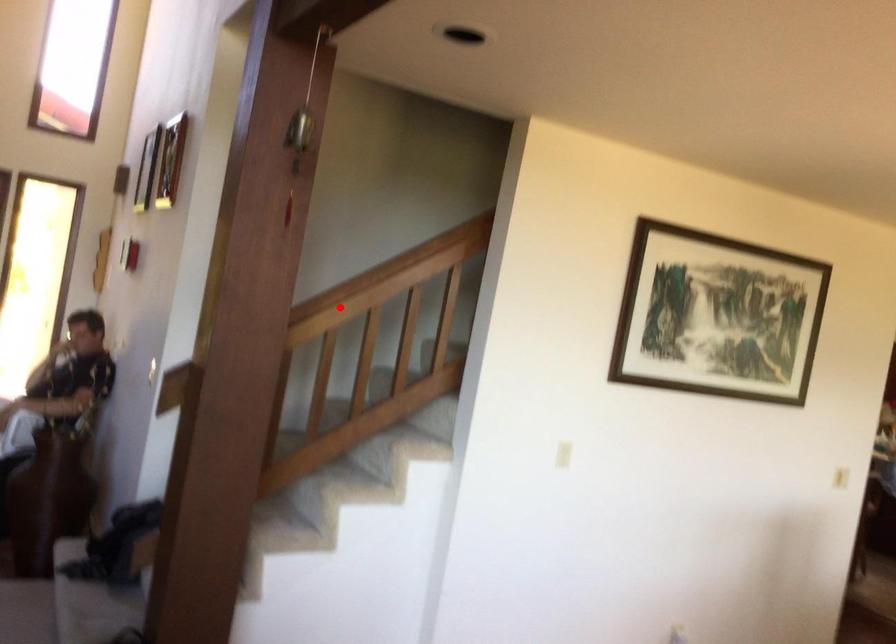
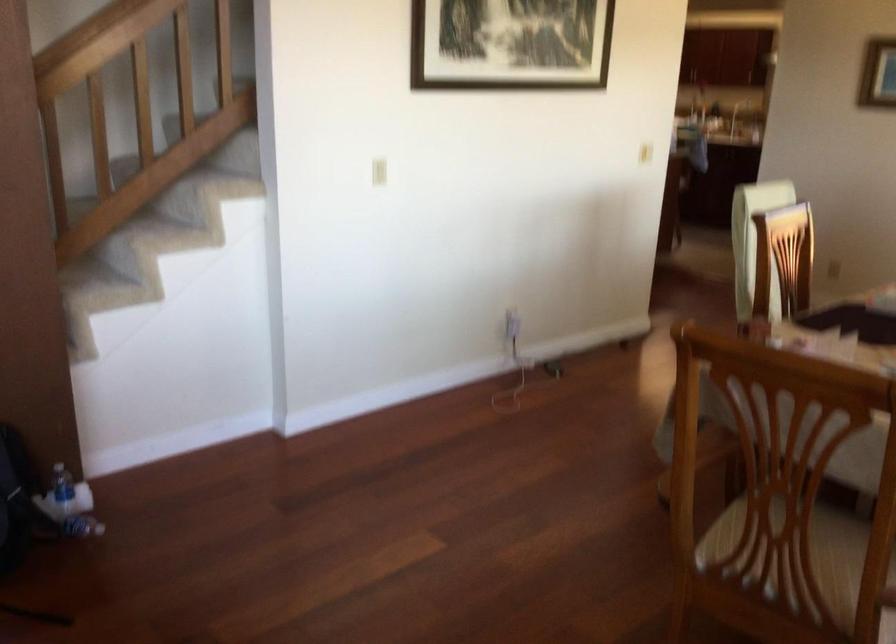
Find the pixel in the second image that matches the highlighted location in the first image.

(104, 40)